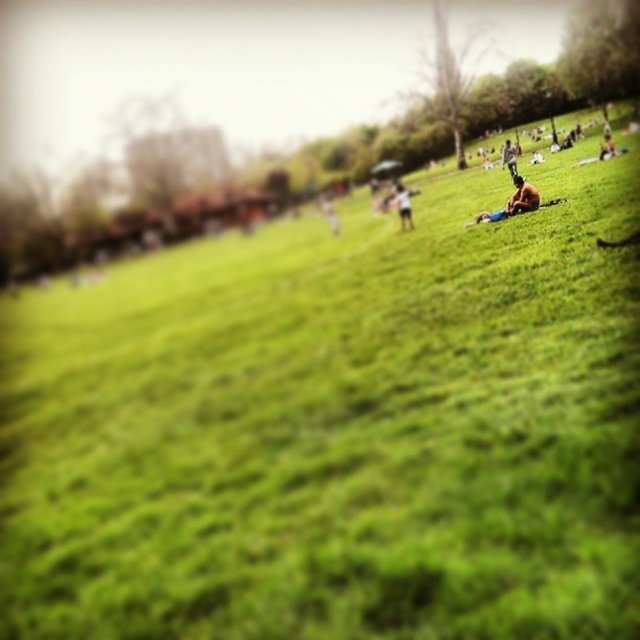
Who is more distant from viewer, (536, 193) or (509, 163)?

Positioned behind is point (509, 163).

Which is behind, point (499, 220) or point (500, 163)?

Positioned behind is point (500, 163).

The image size is (640, 640). In order to click on brown textured shirt at center in this screenshot , I will do `click(513, 202)`.

Who is lower down, brown textured shirt at center or smooth skin person at upper right?

brown textured shirt at center is below.

Does brown textured shirt at center have a larger size compared to smooth skin person at upper right?

Actually, brown textured shirt at center might be smaller than smooth skin person at upper right.

The image size is (640, 640). Find the location of `brown textured shirt at center`. brown textured shirt at center is located at coordinates (513, 202).

Can you confirm if shiny metallic helmet at upper right is positioned to the left of smooth skin person at upper right?

Indeed, shiny metallic helmet at upper right is positioned on the left side of smooth skin person at upper right.

Is the position of shiny metallic helmet at upper right less distant than that of smooth skin person at upper right?

No, shiny metallic helmet at upper right is behind smooth skin person at upper right.

You are a GUI agent. You are given a task and a screenshot of the screen. Output one action in this format:
    pyautogui.click(x=<x>, y=<y>)
    Task: Click on the shiny metallic helmet at upper right
    This screenshot has height=640, width=640.
    Given the screenshot: What is the action you would take?
    pyautogui.click(x=509, y=157)

Where is `shiny metallic helmet at upper right`? shiny metallic helmet at upper right is located at coordinates (509, 157).